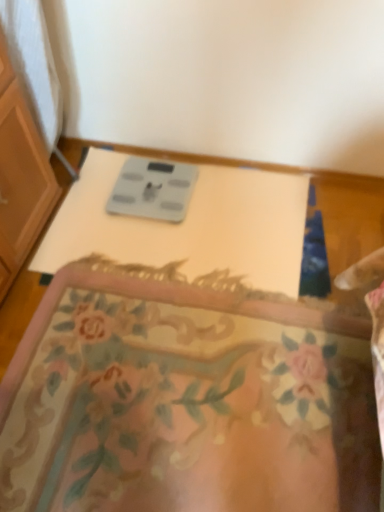
Identify the location of free space above gray matte scale at center (from a real-world perspective). (157, 183).